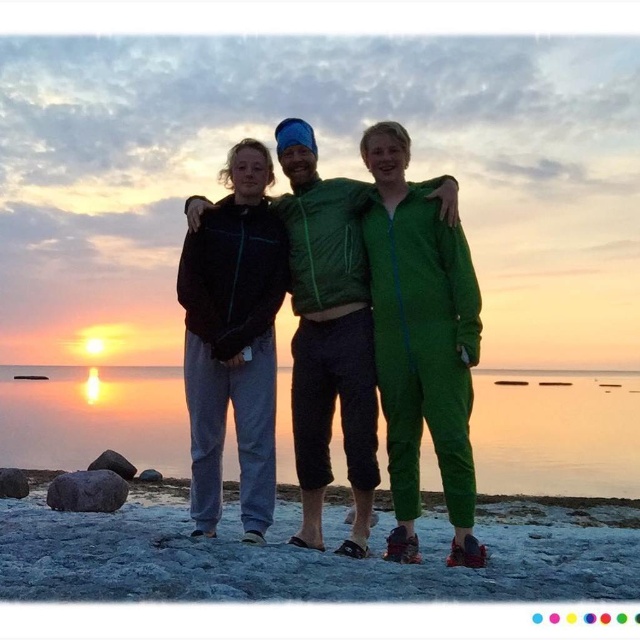
Question: Is translucent glass water at center above matte black jacket at center?

Choices:
 (A) yes
 (B) no

Answer: (B)

Question: Does translucent glass water at center appear under green fleece jumpsuit at center?

Choices:
 (A) yes
 (B) no

Answer: (A)

Question: Which of the following is the farthest from the observer?

Choices:
 (A) sandy at center
 (B) green matte jumpsuit at center

Answer: (B)

Question: Estimate the real-world distances between objects in this image. Which object is farther from the green matte jumpsuit at center?

Choices:
 (A) matte black jacket at center
 (B) sandy at center
 (C) green fleece jumpsuit at center
 (D) translucent glass water at center

Answer: (D)

Question: Does sandy at center appear on the left side of green matte jumpsuit at center?

Choices:
 (A) yes
 (B) no

Answer: (B)

Question: Estimate the real-world distances between objects in this image. Which object is closer to the green matte jumpsuit at center?

Choices:
 (A) green fleece jumpsuit at center
 (B) matte black jacket at center

Answer: (A)